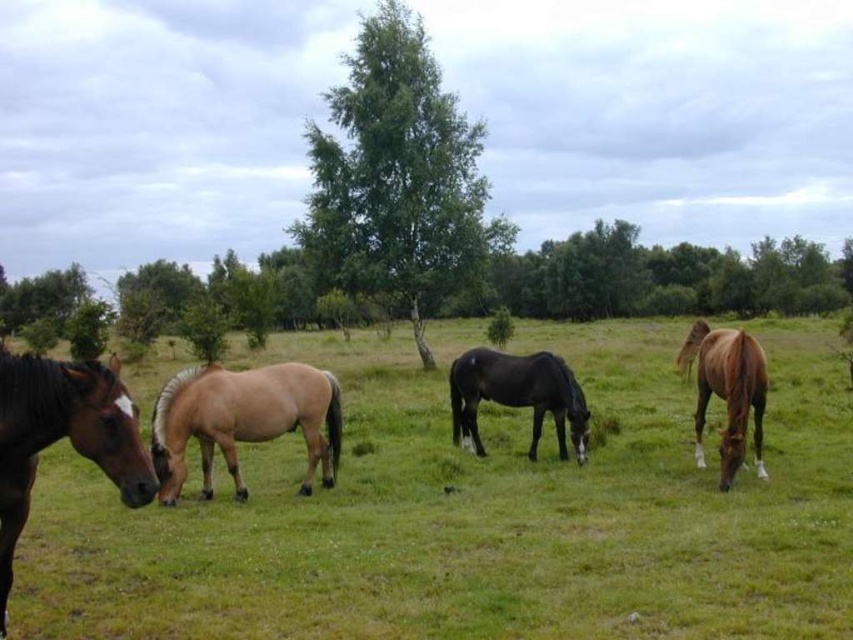
Question: Can you confirm if green grass pasture at lower left is positioned to the left of shiny black horse at center?

Choices:
 (A) yes
 (B) no

Answer: (B)

Question: Estimate the real-world distances between objects in this image. Which object is farther from the green grass pasture at lower left?

Choices:
 (A) light brown glossy horse at center
 (B) brown glossy horse at left
 (C) shiny black horse at center
 (D) brown glossy horse at right

Answer: (B)

Question: Which point appears closest to the camera in this image?

Choices:
 (A) (461, 412)
 (B) (393, 340)
 (C) (311, 371)

Answer: (C)

Question: Considering the relative positions of brown glossy horse at left and brown glossy horse at right in the image provided, where is brown glossy horse at left located with respect to brown glossy horse at right?

Choices:
 (A) above
 (B) below

Answer: (B)

Question: Which object appears closest to the camera in this image?

Choices:
 (A) light brown glossy horse at center
 (B) brown glossy horse at left
 (C) shiny black horse at center
 (D) green grass pasture at lower left

Answer: (B)

Question: In this image, where is light brown glossy horse at center located relative to brown glossy horse at right?

Choices:
 (A) left
 (B) right

Answer: (A)